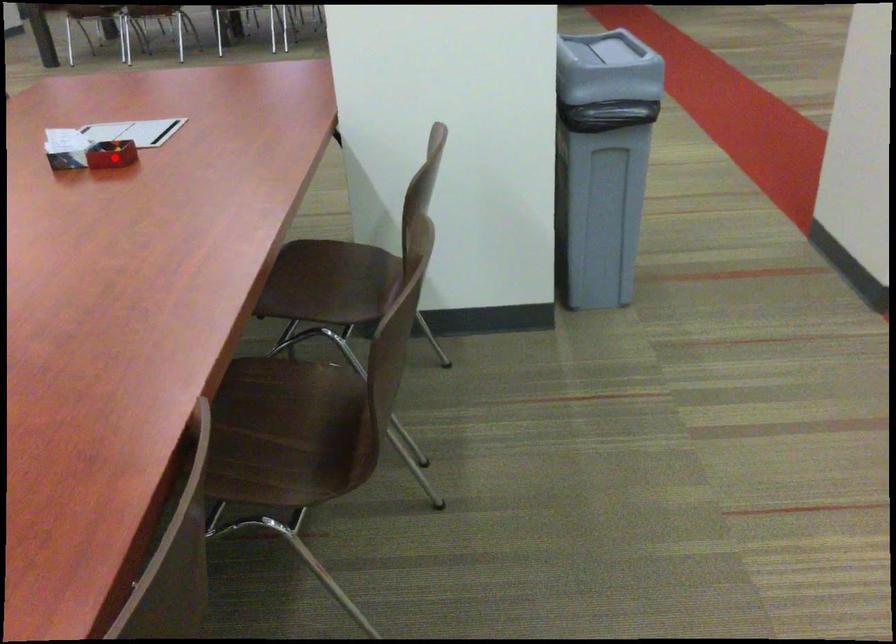
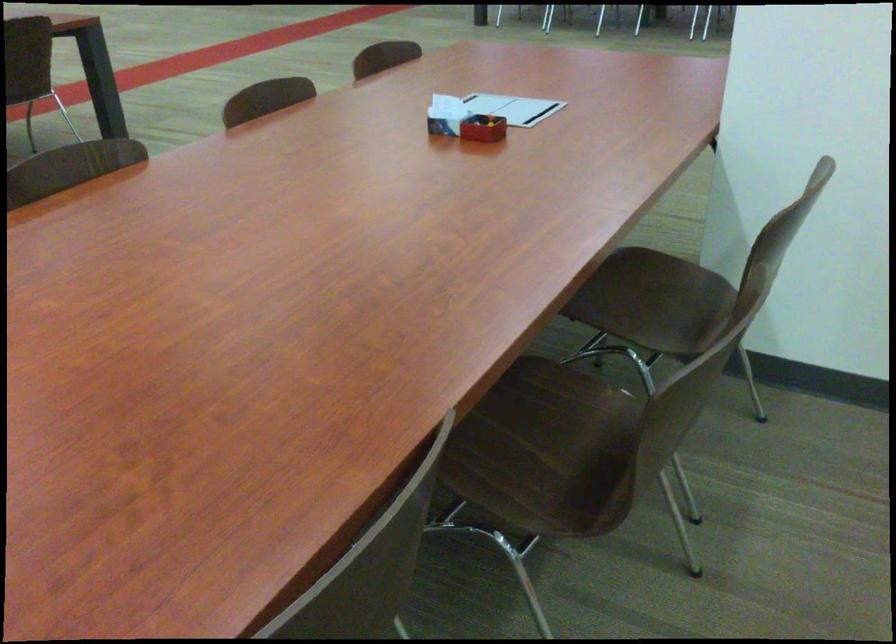
Locate, in the second image, the point that corresponds to the highlighted location in the first image.

(483, 128)